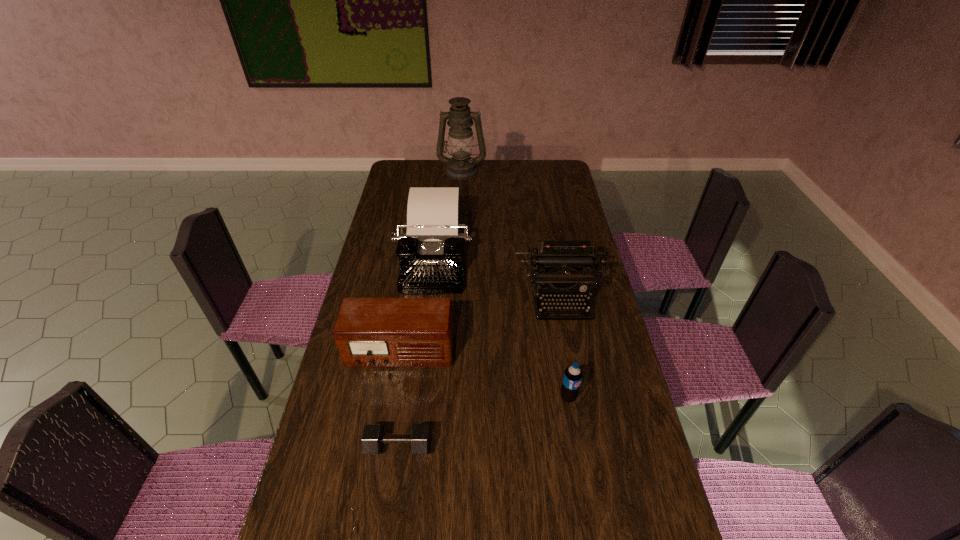
Locate an element on the screen. The height and width of the screenshot is (540, 960). vacant space at the far edge of the desktop is located at coordinates (492, 170).

Where is `vacant space at the left edge`? This screenshot has width=960, height=540. vacant space at the left edge is located at coordinates (396, 198).

Identify the location of free space at the right edge of the desktop. The width and height of the screenshot is (960, 540). (614, 369).

This screenshot has width=960, height=540. I want to click on unoccupied area between the dumbbell and the right typewriter, so click(479, 372).

The height and width of the screenshot is (540, 960). I want to click on unoccupied area between the nearest object and the fourth farthest object, so click(399, 399).

At what (x,y) coordinates should I click in order to perform the action: click on empty location between the second nearest object and the radio receiver. Please return your answer as a coordinate pair (x, y). Looking at the image, I should click on (484, 375).

Image resolution: width=960 pixels, height=540 pixels. What are the coordinates of `free area in between the right typewriter and the nearest object` in the screenshot? It's located at (479, 372).

I want to click on free point between the nearest object and the fifth farthest object, so click(484, 421).

Where is `free space between the dumbbell and the fifth farthest object`? free space between the dumbbell and the fifth farthest object is located at coordinates (484, 421).

At what (x,y) coordinates should I click in order to perform the action: click on vacant area between the tallest object and the right typewriter. Please return your answer as a coordinate pair (x, y). Looking at the image, I should click on (511, 235).